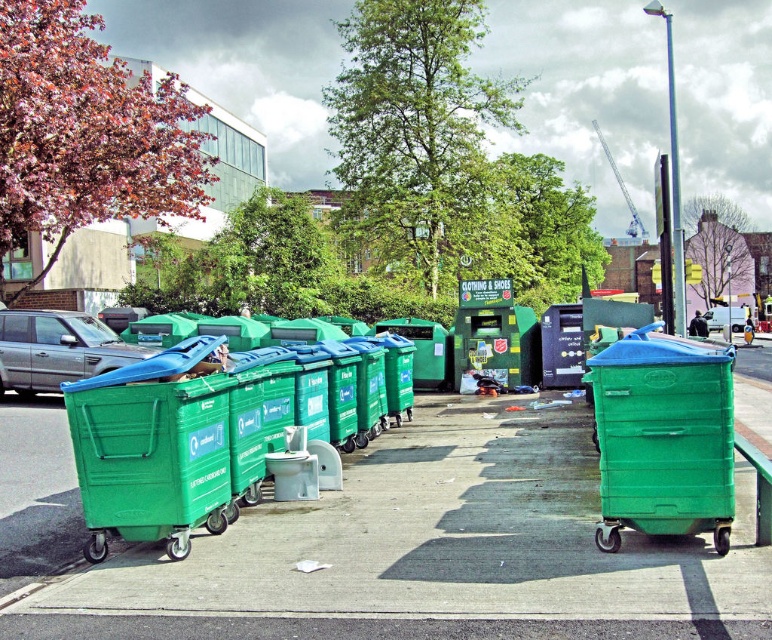
You are standing next to the silver metallic car at left and want to throw a plastic bottle into the green plastic recycling bin at center. Considering the distance between them, is it feasible to make the throw without moving from your current position?

The green plastic recycling bin at center is 12.28 meters away from the silver metallic car at left. Throwing a plastic bottle that distance would be extremely challenging for most people, as typical throwing ranges for such items are much shorter. It would not be feasible to make the throw without moving closer.

Consider the image. You are standing in an outdoor area with recycling bins. There is a green plastic bin at center. If you want to place a large cardboard box into the bin, but you can only reach up to 5 feet, will you be able to throw the cardboard into the bin from your current position?

The green plastic bin at center is 20.15 feet away from the viewer. Since you can only reach up to 5 feet, you will not be able to throw the cardboard into the bin from your current position as it is too far away.

You are a delivery person trying to park your silver metallic car at left near the green plastic recycling bin at center. Can you safely park the car so that it doesn not block the recycling bin?

The green plastic recycling bin at center is in front of the silver metallic car at left, meaning the bin is closer to you than the car. To park the car without blocking the bin, you should position the car behind the bin so that both remain accessible.